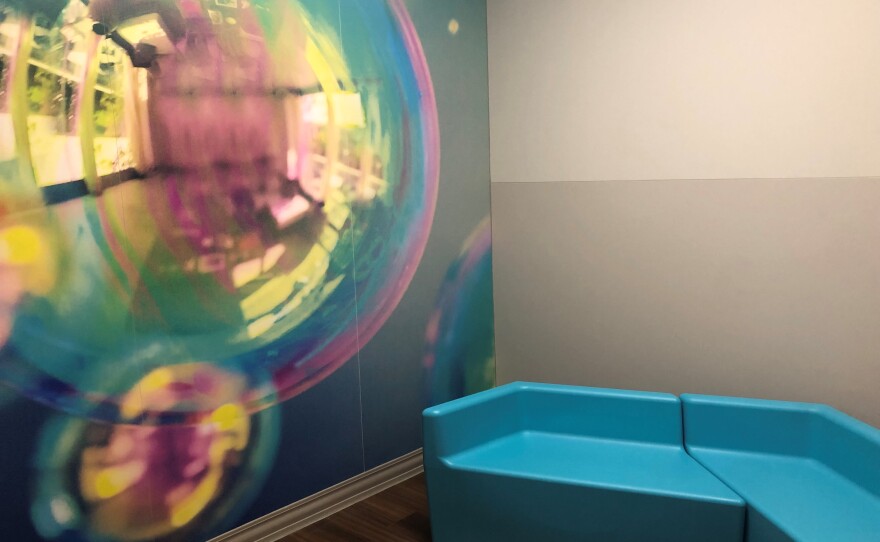
Identify the location of baseboard. This screenshot has height=542, width=880. (362, 490).